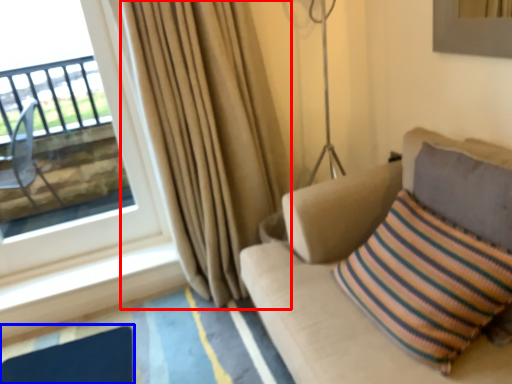
Question: Which object appears farthest to the camera in this image, curtain (highlighted by a red box) or flat (highlighted by a blue box)?

Choices:
 (A) curtain
 (B) flat

Answer: (B)